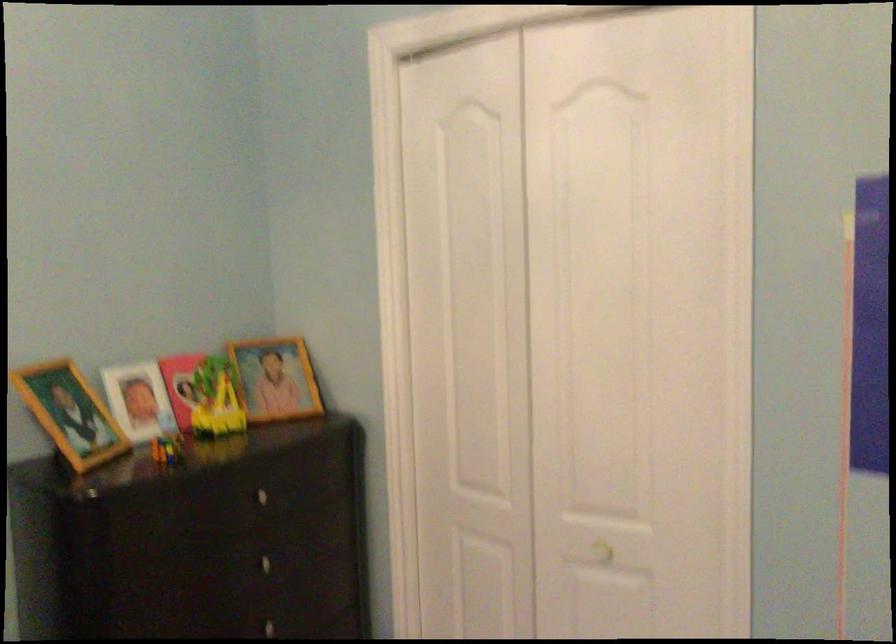
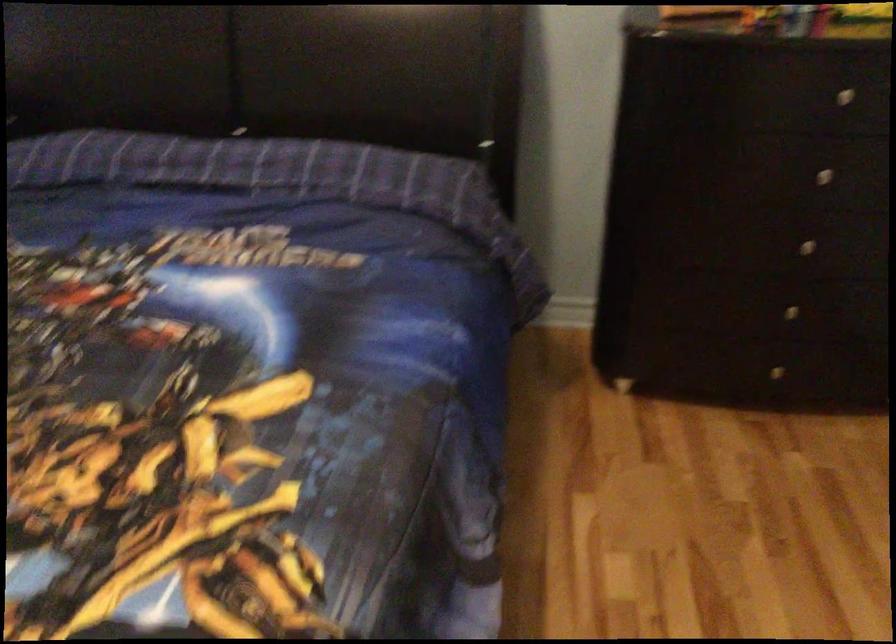
Find the pixel in the second image that matches the point at 271,554 in the first image.

(833, 169)